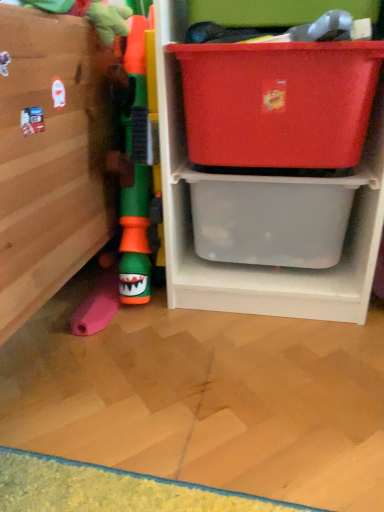
Question: From the image's perspective, is transparent plastic storage box at lower right, which is the 2th storage box in top-to-bottom order, located above matte plastic storage box at upper right, placed as the first storage box when sorted from top to bottom?

Choices:
 (A) yes
 (B) no

Answer: (B)

Question: Is transparent plastic storage box at lower right, the 1th storage box positioned from the bottom, not close to matte plastic storage box at upper right, placed as the first storage box when sorted from top to bottom?

Choices:
 (A) yes
 (B) no

Answer: (B)

Question: Considering the relative sizes of transparent plastic storage box at lower right, which is the 2th storage box in top-to-bottom order, and matte plastic storage box at upper right, the 2th storage box in the bottom-to-top sequence, in the image provided, is transparent plastic storage box at lower right, which is the 2th storage box in top-to-bottom order, thinner than matte plastic storage box at upper right, the 2th storage box in the bottom-to-top sequence,?

Choices:
 (A) yes
 (B) no

Answer: (B)

Question: Is transparent plastic storage box at lower right, which is the 2th storage box in top-to-bottom order, oriented away from matte plastic storage box at upper right, placed as the first storage box when sorted from top to bottom?

Choices:
 (A) yes
 (B) no

Answer: (B)

Question: Is transparent plastic storage box at lower right, which is the 2th storage box in top-to-bottom order, outside of matte plastic storage box at upper right, the 2th storage box in the bottom-to-top sequence?

Choices:
 (A) yes
 (B) no

Answer: (A)

Question: Would you say transparent plastic storage box at lower right, which is the 2th storage box in top-to-bottom order, is to the left or to the right of translucent plastic storage at center in the picture?

Choices:
 (A) left
 (B) right

Answer: (A)

Question: Considering the positions of transparent plastic storage box at lower right, which is the 2th storage box in top-to-bottom order, and translucent plastic storage at center in the image, is transparent plastic storage box at lower right, which is the 2th storage box in top-to-bottom order, bigger or smaller than translucent plastic storage at center?

Choices:
 (A) small
 (B) big

Answer: (A)

Question: Considering the positions of point (281, 192) and point (210, 296), is point (281, 192) closer or farther from the camera than point (210, 296)?

Choices:
 (A) closer
 (B) farther

Answer: (A)

Question: Is transparent plastic storage box at lower right, the 1th storage box positioned from the bottom, wider or thinner than translucent plastic storage at center?

Choices:
 (A) wide
 (B) thin

Answer: (B)

Question: Is matte plastic storage box at upper right, placed as the first storage box when sorted from top to bottom, inside the boundaries of transparent plastic storage box at lower right, which is the 2th storage box in top-to-bottom order, or outside?

Choices:
 (A) inside
 (B) outside

Answer: (B)

Question: Is matte plastic storage box at upper right, the 2th storage box in the bottom-to-top sequence, taller or shorter than transparent plastic storage box at lower right, the 1th storage box positioned from the bottom?

Choices:
 (A) tall
 (B) short

Answer: (A)

Question: From a real-world perspective, is matte plastic storage box at upper right, the 2th storage box in the bottom-to-top sequence, above or below transparent plastic storage box at lower right, the 1th storage box positioned from the bottom?

Choices:
 (A) below
 (B) above

Answer: (B)

Question: Considering the relative positions of matte plastic storage box at upper right, placed as the first storage box when sorted from top to bottom, and transparent plastic storage box at lower right, which is the 2th storage box in top-to-bottom order, in the image provided, is matte plastic storage box at upper right, placed as the first storage box when sorted from top to bottom, to the left or to the right of transparent plastic storage box at lower right, which is the 2th storage box in top-to-bottom order,?

Choices:
 (A) left
 (B) right

Answer: (A)

Question: From the image's perspective, is green rubber toy at left above or below transparent plastic storage box at lower right, the 1th storage box positioned from the bottom?

Choices:
 (A) above
 (B) below

Answer: (A)

Question: From a real-world perspective, is green rubber toy at left positioned above or below transparent plastic storage box at lower right, which is the 2th storage box in top-to-bottom order?

Choices:
 (A) above
 (B) below

Answer: (A)